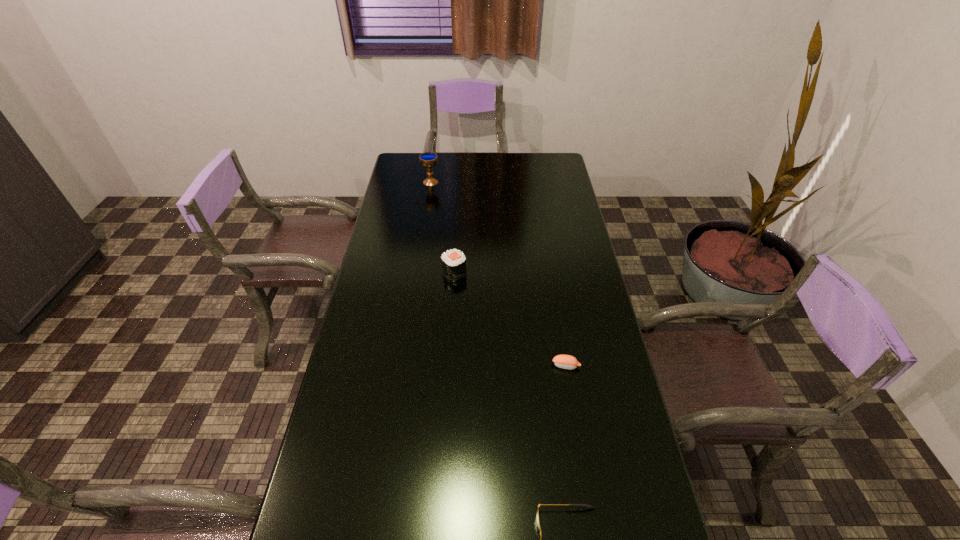
Where is `the tallest object`? the tallest object is located at coordinates (428, 160).

Image resolution: width=960 pixels, height=540 pixels. Find the location of `the leftmost object`. the leftmost object is located at coordinates (428, 160).

Locate an element on the screen. the taller sushi is located at coordinates (453, 261).

Image resolution: width=960 pixels, height=540 pixels. I want to click on the second tallest object, so click(x=453, y=261).

The image size is (960, 540). Find the location of `the shorter sushi`. the shorter sushi is located at coordinates (569, 362).

In order to click on the right sushi in this screenshot , I will do `click(569, 362)`.

I want to click on free spot located on the back of the leftmost object, so click(x=434, y=160).

This screenshot has height=540, width=960. In order to click on vacant region located on the right of the second farthest object in this screenshot , I will do `click(564, 272)`.

Locate an element on the screen. free location located 0.190m on the left of the right sushi is located at coordinates (487, 366).

Identify the location of object present at the far edge. Image resolution: width=960 pixels, height=540 pixels. (428, 160).